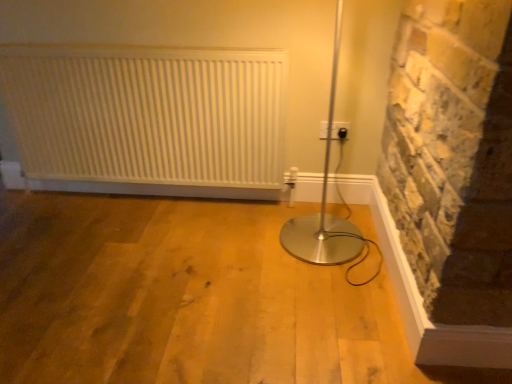
Question: In terms of size, does black plastic electric outlet at upper right appear bigger or smaller than white matte radiator at upper left?

Choices:
 (A) big
 (B) small

Answer: (B)

Question: From the image's perspective, is black plastic electric outlet at upper right located above or below white matte radiator at upper left?

Choices:
 (A) below
 (B) above

Answer: (A)

Question: Does point (320, 125) appear closer or farther from the camera than point (9, 114)?

Choices:
 (A) closer
 (B) farther

Answer: (A)

Question: Relative to black plastic electric outlet at upper right, is white matte radiator at upper left in front or behind?

Choices:
 (A) behind
 (B) front

Answer: (B)

Question: Looking at their shapes, would you say white matte radiator at upper left is wider or thinner than black plastic electric outlet at upper right?

Choices:
 (A) wide
 (B) thin

Answer: (A)

Question: From the image's perspective, is white matte radiator at upper left above or below black plastic electric outlet at upper right?

Choices:
 (A) below
 (B) above

Answer: (B)

Question: Is white matte radiator at upper left spatially inside black plastic electric outlet at upper right, or outside of it?

Choices:
 (A) outside
 (B) inside

Answer: (A)